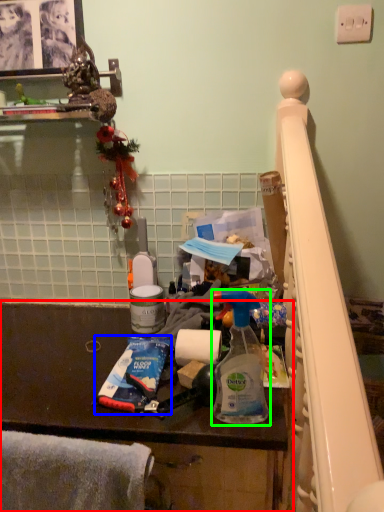
Question: Considering the real-world distances, which object is farthest from furniture (highlighted by a red box)? toothpaste (highlighted by a blue box) or bottle (highlighted by a green box)?

Choices:
 (A) toothpaste
 (B) bottle

Answer: (B)